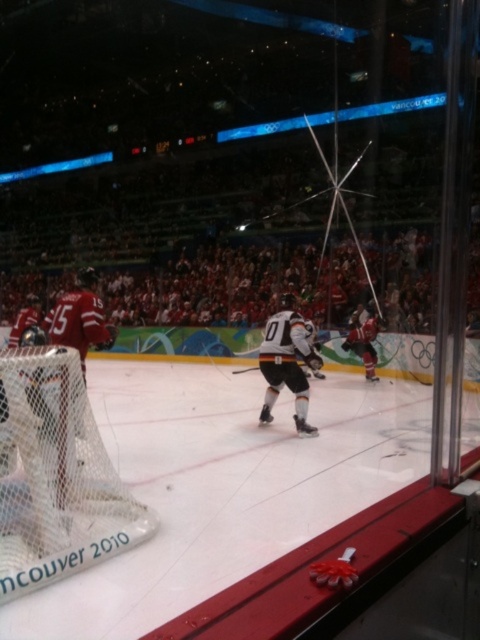
The height and width of the screenshot is (640, 480). What do you see at coordinates (287, 362) in the screenshot? I see `white jersey at center` at bounding box center [287, 362].

Find the location of a particular element. This screenshot has width=480, height=640. white jersey at center is located at coordinates (287, 362).

Is matte red jersey at right behind black matte hockey stick at center?

Yes, it is.

Is point (370, 365) positioned before point (314, 371)?

No, (370, 365) is behind (314, 371).

You are a GUI agent. You are given a task and a screenshot of the screen. Output one action in this format:
    pyautogui.click(x=<x>, y=<y>)
    Task: Click on the matte red jersey at right
    The image size is (480, 640).
    Given the screenshot: What is the action you would take?
    pyautogui.click(x=363, y=342)

Consider the image. Who is more forward, (288, 330) or (372, 369)?

Positioned in front is point (288, 330).

Is white jersey at center bigger than matte red jersey at right?

Incorrect, white jersey at center is not larger than matte red jersey at right.

Is point (292, 349) less distant than point (358, 349)?

Yes, it is in front of point (358, 349).

At what (x,y) coordinates should I click in order to perform the action: click on white jersey at center. Please return your answer as a coordinate pair (x, y). Image resolution: width=480 pixels, height=640 pixels. Looking at the image, I should click on pos(287,362).